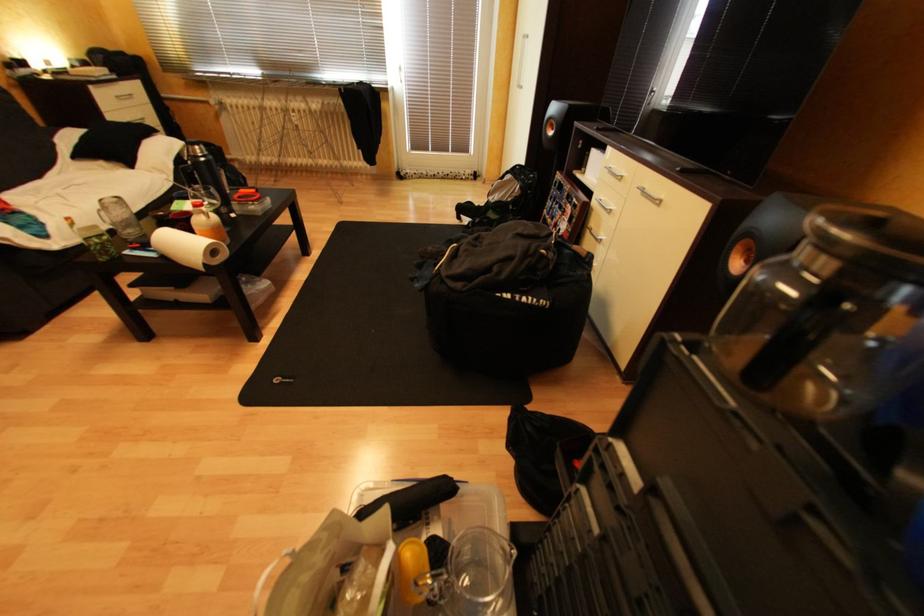
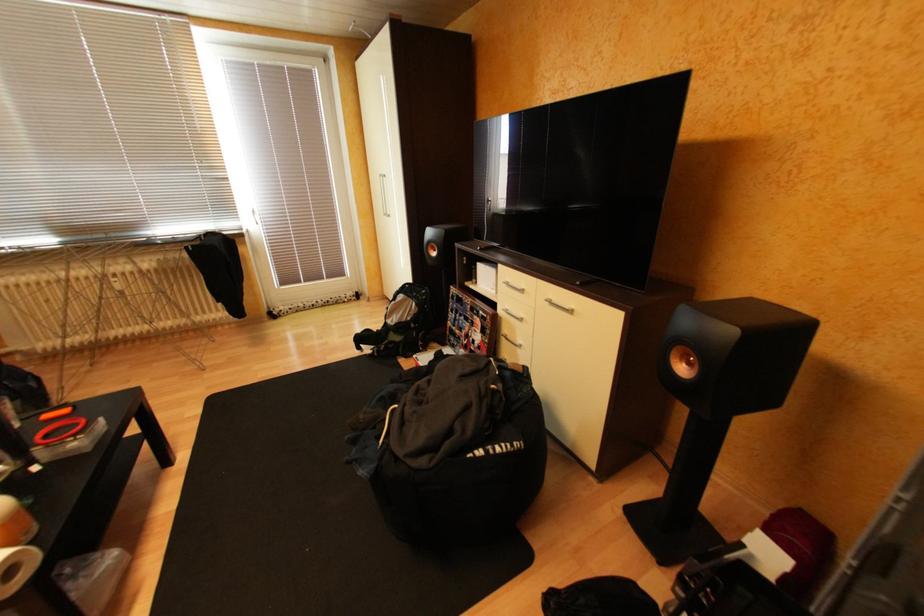
In a continuous first-person perspective shot, in which direction is the camera moving?

The movement direction of the cameraman is left, forward.